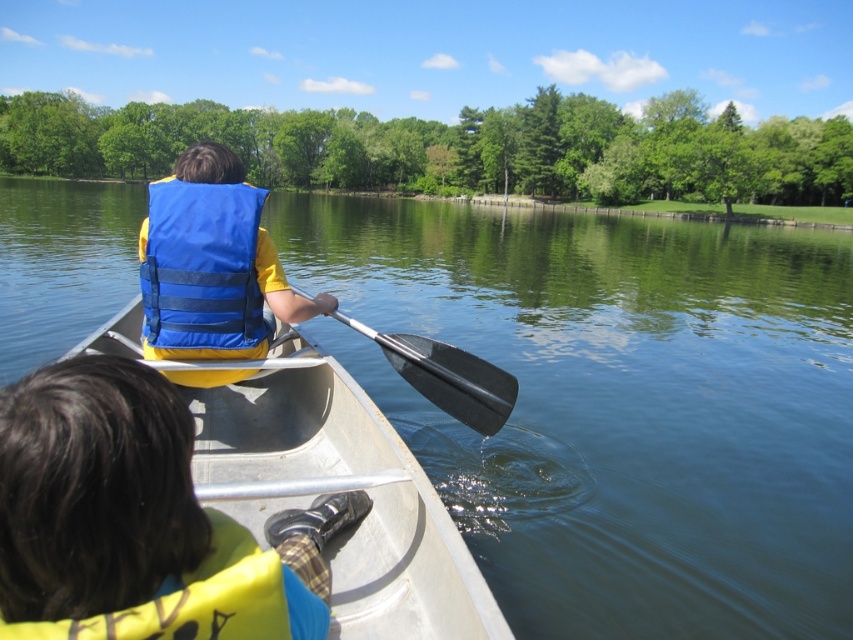
You are a photographer trying to capture the perfect shot of the yellow fabric life vest at center and the black rubber paddle at center. Based on their positions, which object should you focus on first to ensure both are in frame?

Result: The yellow fabric life vest at center is located below the black rubber paddle at center, so you should focus on the black rubber paddle at center first to ensure both are in frame.

You are planning to pack for a canoe trip and have both the yellow fabric life vest at center and the yellow fleece life jacket at lower left. If you want to choose the one that takes up more space in your backpack, which should you pick?

The yellow fabric life vest at center has a larger width than the yellow fleece life jacket at lower left, so it takes up more space in the backpack.